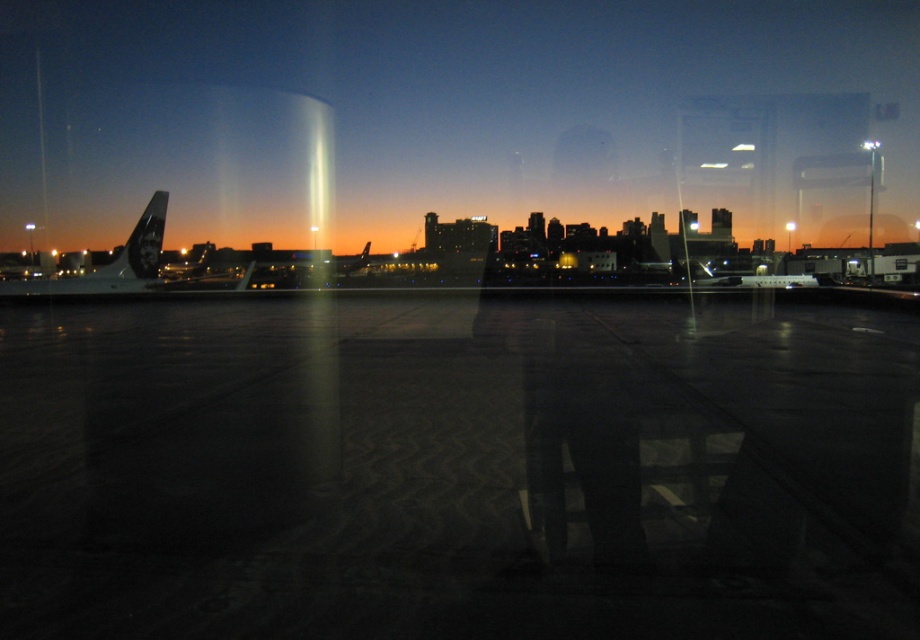
You are a pilot preparing for takeoff and need to ensure there is enough vertical clearance between your plane and the nearby structures. You observe the white matte airplane at left and the metallic silver airplane at center in your line of sight. Which airplane would require you to adjust your altitude more due to its height?

The white matte airplane at left is much taller than the metallic silver airplane at center, so adjusting altitude based on its height would be necessary to ensure sufficient vertical clearance.

You are standing in the airport terminal and looking through the glass window. You notice two points marked on the window at coordinates point (x=77, y=289) and point (x=778, y=284). Which point is closer to you?

Point (x=77, y=289) is closer to the viewer than point (x=778, y=284).

You are a passenger waiting at the airport and see the white matte airplane at left and the metallic silver airplane at center through the window. Which airplane would you board if your flight is assigned to the one closer to the window?

You should board the white matte airplane at left because it is closer to the viewer, which in this case is the window, making it the nearer option.